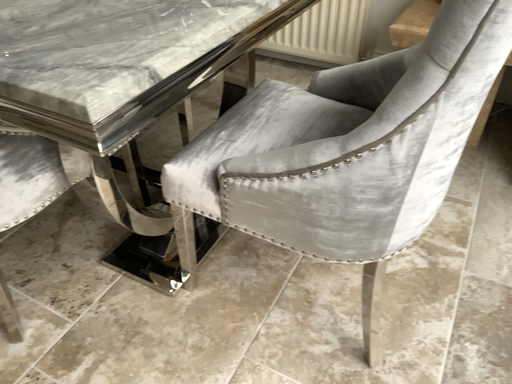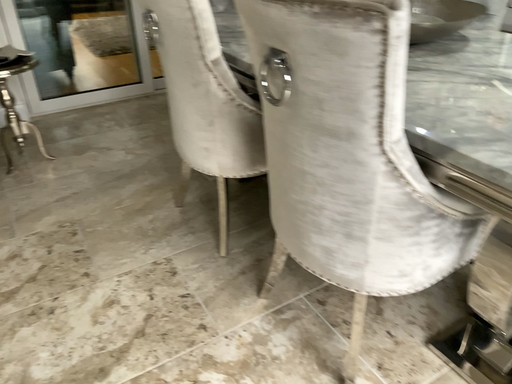
Question: How did the camera likely rotate when shooting the video?

Choices:
 (A) rotated downward
 (B) rotated upward

Answer: (B)